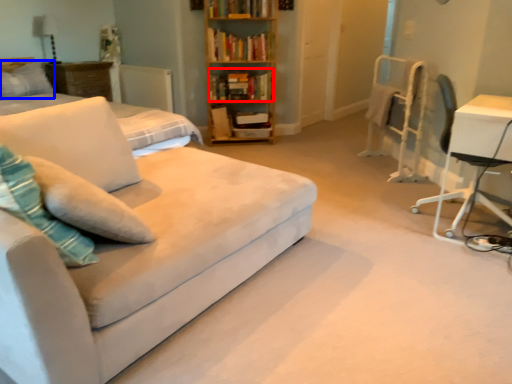
Question: Which object is further to the camera taking this photo, book (highlighted by a red box) or pillow (highlighted by a blue box)?

Choices:
 (A) book
 (B) pillow

Answer: (A)